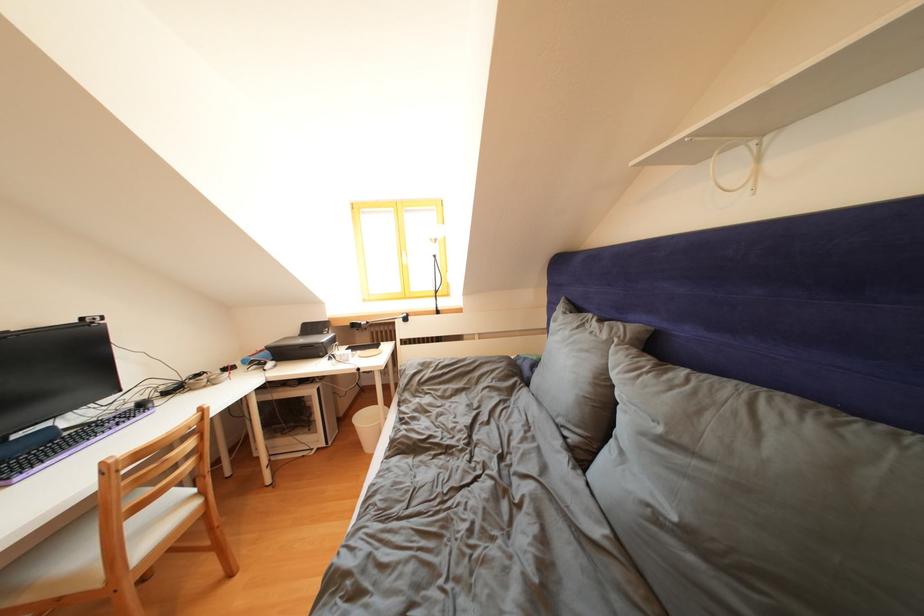
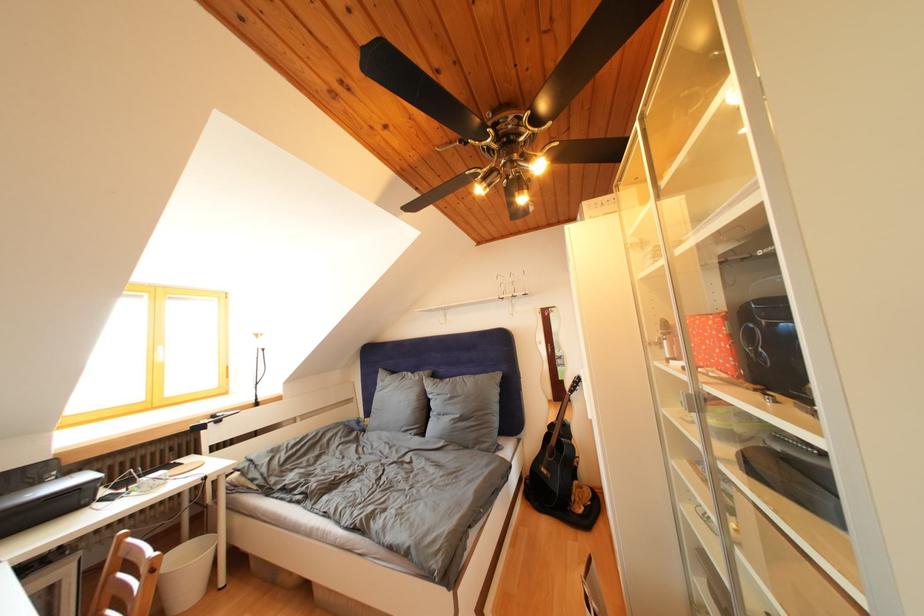
Where in the second image is the point corresponding to the point at 329,338 from the first image?

(44, 488)